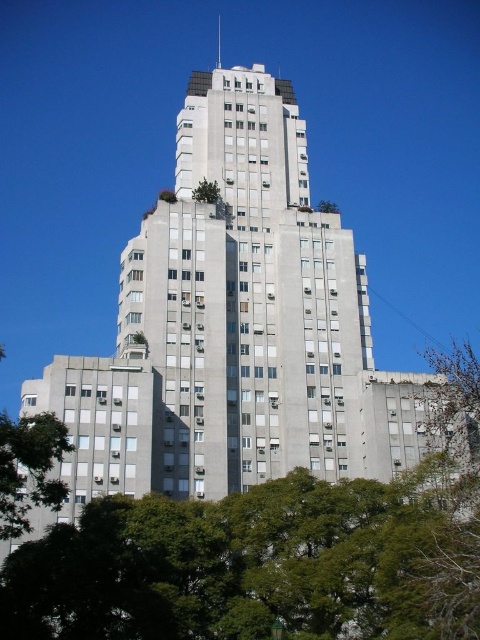
Question: Which object is the closest to the green leafy tree at upper center?

Choices:
 (A) green leafy tree at lower left
 (B) green leafy tree at center

Answer: (A)

Question: Can you confirm if green leafy tree at lower left is positioned to the right of green leafy tree at center?

Choices:
 (A) no
 (B) yes

Answer: (A)

Question: Is green leafy tree at lower center wider than green leafy tree at upper center?

Choices:
 (A) yes
 (B) no

Answer: (A)

Question: Is the position of green leafy tree at lower left more distant than that of green leafy tree at center?

Choices:
 (A) yes
 (B) no

Answer: (B)

Question: Estimate the real-world distances between objects in this image. Which object is farther from the green leafy tree at upper center?

Choices:
 (A) green leafy tree at lower center
 (B) green leafy tree at lower left
 (C) green leafy tree at center

Answer: (A)

Question: Which point appears closest to the camera in this image?

Choices:
 (A) (141, 593)
 (B) (322, 209)
 (C) (216, 202)

Answer: (A)